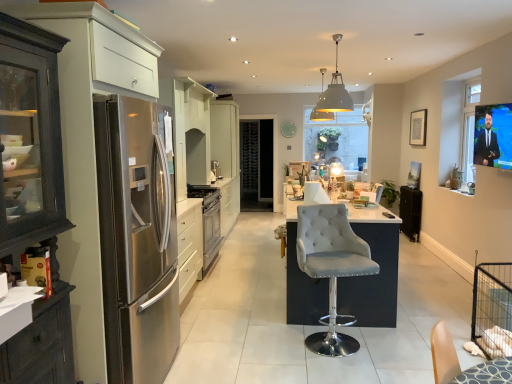
Question: Is matte gray pendant light at center wider than white glossy cabinet at center?

Choices:
 (A) yes
 (B) no

Answer: (B)

Question: Is matte gray pendant light at center outside of white glossy cabinet at center?

Choices:
 (A) yes
 (B) no

Answer: (A)

Question: Can you confirm if matte gray pendant light at center is taller than white glossy cabinet at center?

Choices:
 (A) no
 (B) yes

Answer: (A)

Question: From the image's perspective, is matte gray pendant light at center below white glossy cabinet at center?

Choices:
 (A) yes
 (B) no

Answer: (B)

Question: Considering the relative sizes of matte gray pendant light at center and white glossy cabinet at center in the image provided, is matte gray pendant light at center shorter than white glossy cabinet at center?

Choices:
 (A) no
 (B) yes

Answer: (B)

Question: Looking at their shapes, would you say black glass wine cellar at center is wider or thinner than black matte radiator at right, acting as the first appliance starting from the bottom?

Choices:
 (A) wide
 (B) thin

Answer: (A)

Question: Is point (267, 183) positioned closer to the camera than point (407, 210)?

Choices:
 (A) farther
 (B) closer

Answer: (A)

Question: From the image's perspective, is black glass wine cellar at center positioned above or below black matte radiator at right, marked as the second appliance in a left-to-right arrangement?

Choices:
 (A) above
 (B) below

Answer: (A)

Question: Relative to black matte radiator at right, which appears as the 2th appliance when viewed from the top, is black glass wine cellar at center in front or behind?

Choices:
 (A) behind
 (B) front

Answer: (A)

Question: From a real-world perspective, is black matte radiator at right, positioned as the 1th appliance in right-to-left order, physically located above or below satin silver refrigerator at left?

Choices:
 (A) below
 (B) above

Answer: (A)

Question: Is black matte radiator at right, marked as the second appliance in a left-to-right arrangement, situated inside satin silver refrigerator at left or outside?

Choices:
 (A) outside
 (B) inside

Answer: (A)

Question: Considering the positions of black matte radiator at right, marked as the second appliance in a left-to-right arrangement, and satin silver refrigerator at left in the image, is black matte radiator at right, marked as the second appliance in a left-to-right arrangement, wider or thinner than satin silver refrigerator at left?

Choices:
 (A) wide
 (B) thin

Answer: (B)

Question: Is black matte radiator at right, which appears as the 2th appliance when viewed from the top, to the left or to the right of satin silver refrigerator at left in the image?

Choices:
 (A) left
 (B) right

Answer: (B)

Question: Would you say suede-like gray bar stool at center is to the left or to the right of white glossy cabinet at center in the picture?

Choices:
 (A) right
 (B) left

Answer: (A)

Question: Does point (330, 321) appear closer or farther from the camera than point (230, 158)?

Choices:
 (A) farther
 (B) closer

Answer: (B)